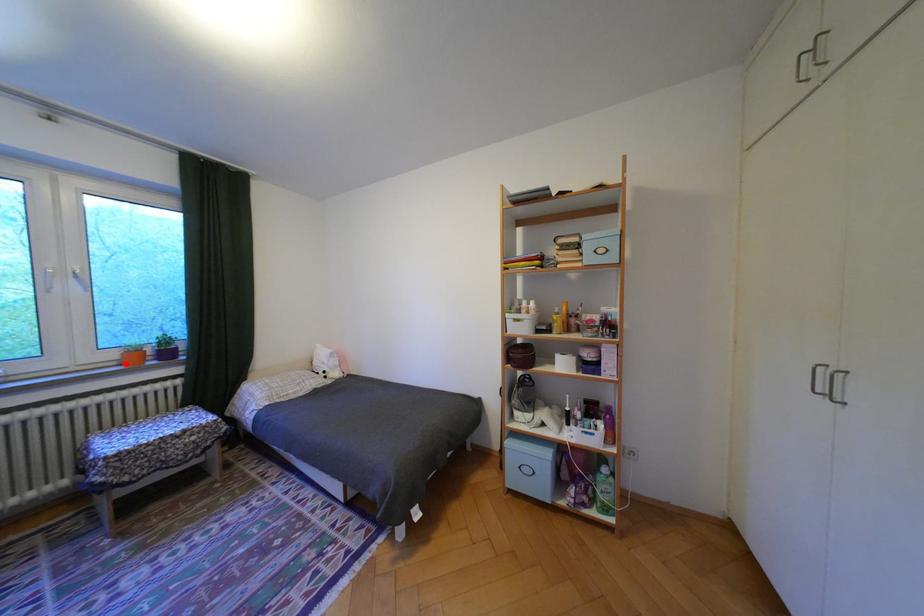
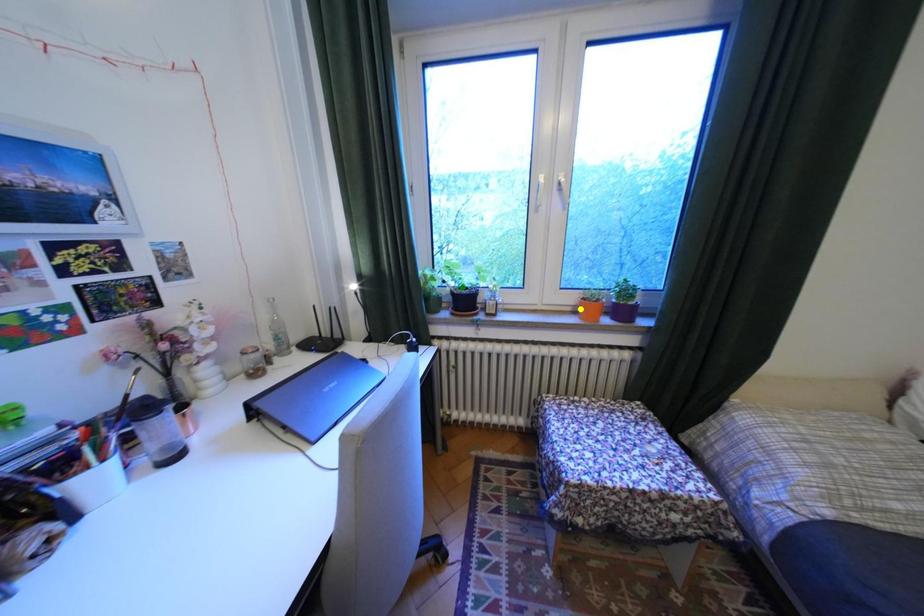
Question: I am providing you with two images of the same scene from different viewpoints. A red point is marked on the first image. You are given multiple points on the second image. Which mark in image 2 goes with the point in image 1?

Choices:
 (A) blue point
 (B) yellow point
 (C) green point

Answer: (B)